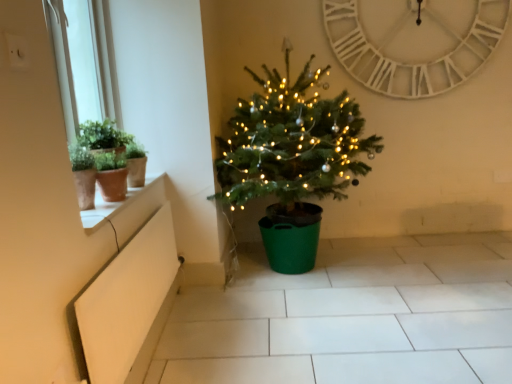
This screenshot has width=512, height=384. What do you see at coordinates (291, 160) in the screenshot? I see `green matte christmas tree at center` at bounding box center [291, 160].

The width and height of the screenshot is (512, 384). Find the location of `white matte window box at lower left`. white matte window box at lower left is located at coordinates (127, 304).

What do you see at coordinates (127, 304) in the screenshot? This screenshot has width=512, height=384. I see `white matte window box at lower left` at bounding box center [127, 304].

In order to face white wooden clock at upper center, should I rotate leftwards or rightwards?

You should rotate right by 20.875 degrees.

Describe the element at coordinates (413, 42) in the screenshot. I see `white wooden clock at upper center` at that location.

The height and width of the screenshot is (384, 512). Identify the location of green matte christmas tree at center. (291, 160).

From the image's perspective, is white glossy window sill at upper left below white matte window box at lower left?

No, from the image's perspective, white glossy window sill at upper left is not below white matte window box at lower left.

Considering the positions of objects white glossy window sill at upper left and white matte window box at lower left in the image provided, who is more to the left, white glossy window sill at upper left or white matte window box at lower left?

white glossy window sill at upper left.

Is white glossy window sill at upper left taller than white matte window box at lower left?

Incorrect, the height of white glossy window sill at upper left is not larger of that of white matte window box at lower left.

The height and width of the screenshot is (384, 512). Find the location of `window sill located above the white matte window box at lower left (from a real-world perspective)`. window sill located above the white matte window box at lower left (from a real-world perspective) is located at coordinates (113, 204).

What's the angular difference between green matte christmas tree at center and white matte window box at lower left's facing directions?

The facing directions of green matte christmas tree at center and white matte window box at lower left are 91.7 degrees apart.

From the image's perspective, relative to white matte window box at lower left, is green matte christmas tree at center above or below?

Clearly, from the image's perspective, green matte christmas tree at center is above white matte window box at lower left.

From a real-world perspective, does green matte christmas tree at center stand above white matte window box at lower left?

Yes, from a real-world perspective, green matte christmas tree at center is on top of white matte window box at lower left.

Considering the sizes of objects green matte christmas tree at center and white matte window box at lower left in the image provided, who is wider, green matte christmas tree at center or white matte window box at lower left?

green matte christmas tree at center.

Is white glossy window sill at upper left looking in the opposite direction of white wooden clock at upper center?

No.

Are white glossy window sill at upper left and white wooden clock at upper center located far from each other?

Yes.

Is green matte christmas tree at center at the back of white glossy window sill at upper left?

No, white glossy window sill at upper left is not facing the opposite direction of green matte christmas tree at center.

Considering the relative positions of white glossy window sill at upper left and green matte christmas tree at center in the image provided, is white glossy window sill at upper left to the left of green matte christmas tree at center from the viewer's perspective?

Indeed, white glossy window sill at upper left is positioned on the left side of green matte christmas tree at center.

Which of these two, white glossy window sill at upper left or green matte christmas tree at center, stands shorter?

Standing shorter between the two is white glossy window sill at upper left.

Which of these two, white wooden clock at upper center or green matte christmas tree at center, is thinner?

white wooden clock at upper center is thinner.

This screenshot has width=512, height=384. Find the location of `christmas tree below the white wooden clock at upper center (from a real-world perspective)`. christmas tree below the white wooden clock at upper center (from a real-world perspective) is located at coordinates (291, 160).

Is white wooden clock at upper center taller or shorter than green matte christmas tree at center?

Considering their sizes, white wooden clock at upper center has less height than green matte christmas tree at center.

From a real-world perspective, is green matte christmas tree at center under white wooden clock at upper center?

Yes, from a real-world perspective, green matte christmas tree at center is beneath white wooden clock at upper center.

Between green matte christmas tree at center and white wooden clock at upper center, which one has smaller width?

white wooden clock at upper center.

Does green matte christmas tree at center come in front of white wooden clock at upper center?

Yes, green matte christmas tree at center is closer to the viewer.

Is green matte christmas tree at center facing away from white wooden clock at upper center?

No, green matte christmas tree at center is not facing away from white wooden clock at upper center.

Which is nearer, (117, 315) or (362, 165)?

Point (117, 315)

Is white matte window box at lower left behind green matte christmas tree at center?

No.

Is white matte window box at lower left wider or thinner than green matte christmas tree at center?

white matte window box at lower left is thinner than green matte christmas tree at center.

Where is `window box in front of the white glossy window sill at upper left`? Image resolution: width=512 pixels, height=384 pixels. window box in front of the white glossy window sill at upper left is located at coordinates (127, 304).

Where is `window box below the green matte christmas tree at center (from the image's perspective)`? Image resolution: width=512 pixels, height=384 pixels. window box below the green matte christmas tree at center (from the image's perspective) is located at coordinates (127, 304).

Based on their spatial positions, is white glossy window sill at upper left or green matte christmas tree at center closer to white matte window box at lower left?

white glossy window sill at upper left is closer to white matte window box at lower left.

When comparing their distances from white matte window box at lower left, does white wooden clock at upper center or white glossy window sill at upper left seem further?

white wooden clock at upper center is positioned further to the anchor white matte window box at lower left.

Looking at the image, which one is located further to green matte christmas tree at center, white wooden clock at upper center or white glossy window sill at upper left?

white glossy window sill at upper left is positioned further to the anchor green matte christmas tree at center.

Based on their spatial positions, is white matte window box at lower left or green matte christmas tree at center further from white wooden clock at upper center?

Among the two, white matte window box at lower left is located further to white wooden clock at upper center.

Estimate the real-world distances between objects in this image. Which object is closer to green matte christmas tree at center, white matte window box at lower left or white glossy window sill at upper left?

Among the two, white matte window box at lower left is located nearer to green matte christmas tree at center.

When comparing their distances from white glossy window sill at upper left, does white matte window box at lower left or white wooden clock at upper center seem further?

white wooden clock at upper center lies further to white glossy window sill at upper left than the other object.

Considering their positions, is white matte window box at lower left positioned further to green matte christmas tree at center than white wooden clock at upper center?

Based on the image, white wooden clock at upper center appears to be further to green matte christmas tree at center.

When comparing their distances from white wooden clock at upper center, does white glossy window sill at upper left or white matte window box at lower left seem closer?

white matte window box at lower left.

You are a GUI agent. You are given a task and a screenshot of the screen. Output one action in this format:
    pyautogui.click(x=<x>, y=<y>)
    Task: Click on the christmas tree positioned between white matte window box at lower left and white wooden clock at upper center from near to far
    This screenshot has height=384, width=512.
    Given the screenshot: What is the action you would take?
    (291, 160)

Identify the location of window box between white glossy window sill at upper left and white wooden clock at upper center. The width and height of the screenshot is (512, 384). (127, 304).

Where is `window box between white glossy window sill at upper left and green matte christmas tree at center in the horizontal direction`? This screenshot has height=384, width=512. window box between white glossy window sill at upper left and green matte christmas tree at center in the horizontal direction is located at coordinates (127, 304).

Where is `christmas tree located between white glossy window sill at upper left and white wooden clock at upper center in the left-right direction`? christmas tree located between white glossy window sill at upper left and white wooden clock at upper center in the left-right direction is located at coordinates (291, 160).